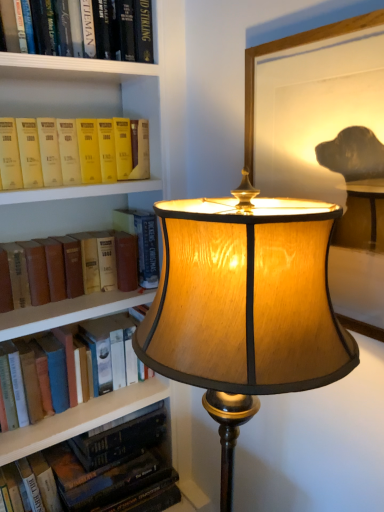
You are a GUI agent. You are given a task and a screenshot of the screen. Output one action in this format:
    pyautogui.click(x=<x>, y=<y>)
    Task: Click on the hardcover book at center, the 4th book in the bottom-to-top sequence
    Image resolution: width=384 pixels, height=512 pixels.
    Given the screenshot: What is the action you would take?
    pyautogui.click(x=141, y=242)

This screenshot has width=384, height=512. Find the location of `hardcover book at lower left, which is the fifth book from top to bottom`. hardcover book at lower left, which is the fifth book from top to bottom is located at coordinates pos(113,461).

Is point (93, 471) positioned behind point (105, 227)?

That is False.

Consider the image. Between hardcover book at lower left, which is the fifth book from top to bottom, and brown leather book at left, which is counted as the 3th book, starting from the bottom, which one is positioned in front?

brown leather book at left, which is counted as the 3th book, starting from the bottom, is closer to the camera.

Is hardcover book at lower left, which is the fifth book from top to bottom, with brown leather book at left, which is counted as the 3th book, starting from the top?

They are not placed beside each other.

Is there a large distance between wooden picture frame at upper right and wooden lampshade at center?

That's not correct — wooden picture frame at upper right is a little close to wooden lampshade at center.

From the image's perspective, which object appears higher, wooden picture frame at upper right or wooden lampshade at center?

wooden picture frame at upper right appears higher in the image.

Looking at this image, considering the relative sizes of wooden picture frame at upper right and wooden lampshade at center in the image provided, is wooden picture frame at upper right smaller than wooden lampshade at center?

Yes, wooden picture frame at upper right is smaller than wooden lampshade at center.

Considering the sizes of matte yellow book at left, placed as the first book when sorted from top to bottom, and hardcover book at left, placed as the 4th book when sorted from top to bottom, in the image, is matte yellow book at left, placed as the first book when sorted from top to bottom, wider or thinner than hardcover book at left, placed as the 4th book when sorted from top to bottom,?

Considering their sizes, matte yellow book at left, placed as the first book when sorted from top to bottom, looks broader than hardcover book at left, placed as the 4th book when sorted from top to bottom.

Based on their sizes in the image, would you say matte yellow book at left, the 5th book from the bottom, is bigger or smaller than hardcover book at left, placed as the 4th book when sorted from top to bottom?

In the image, matte yellow book at left, the 5th book from the bottom, appears to be smaller than hardcover book at left, placed as the 4th book when sorted from top to bottom.

Between matte yellow book at left, placed as the first book when sorted from top to bottom, and hardcover book at left, placed as the 4th book when sorted from top to bottom, which one has more height?

Standing taller between the two is hardcover book at left, placed as the 4th book when sorted from top to bottom.

Is hardcover book at lower left, positioned as the 1th book in bottom-to-top order, positioned with its back to wooden lampshade at center?

No, wooden lampshade at center is not at the back of hardcover book at lower left, positioned as the 1th book in bottom-to-top order.

Considering their positions, is hardcover book at lower left, which is the fifth book from top to bottom, located in front of or behind wooden lampshade at center?

In the image, hardcover book at lower left, which is the fifth book from top to bottom, appears behind wooden lampshade at center.

Between hardcover book at lower left, which is the fifth book from top to bottom, and wooden lampshade at center, which one has more height?

wooden lampshade at center.

Which of these two, hardcover book at lower left, which is the fifth book from top to bottom, or wooden lampshade at center, is wider?

wooden lampshade at center is wider.

Considering the positions of objects wooden lampshade at center and hardcover book at lower left, positioned as the 1th book in bottom-to-top order, in the image provided, who is behind, wooden lampshade at center or hardcover book at lower left, positioned as the 1th book in bottom-to-top order,?

hardcover book at lower left, positioned as the 1th book in bottom-to-top order, is further away from the camera.

From the image's perspective, is wooden lampshade at center above or below hardcover book at lower left, which is the fifth book from top to bottom?

wooden lampshade at center is situated higher than hardcover book at lower left, which is the fifth book from top to bottom, in the image.

Looking at this image, is wooden lampshade at center aimed at hardcover book at lower left, which is the fifth book from top to bottom?

No.

Considering the sizes of wooden picture frame at upper right and brown leather book at left, which is counted as the 3th book, starting from the top, in the image, is wooden picture frame at upper right taller or shorter than brown leather book at left, which is counted as the 3th book, starting from the top,?

wooden picture frame at upper right is taller than brown leather book at left, which is counted as the 3th book, starting from the top.

Considering the relative positions of wooden picture frame at upper right and brown leather book at left, which is counted as the 3th book, starting from the bottom, in the image provided, is wooden picture frame at upper right to the left of brown leather book at left, which is counted as the 3th book, starting from the bottom, from the viewer's perspective?

No.

Based on the photo, how distant is wooden picture frame at upper right from brown leather book at left, which is counted as the 3th book, starting from the top?

wooden picture frame at upper right is 20.57 inches from brown leather book at left, which is counted as the 3th book, starting from the top.

From a real-world perspective, is wooden picture frame at upper right positioned over brown leather book at left, which is counted as the 3th book, starting from the bottom, based on gravity?

Correct, in the physical world, wooden picture frame at upper right is higher than brown leather book at left, which is counted as the 3th book, starting from the bottom.

From a real-world perspective, is hardcover book at left, the 2th book when ordered from bottom to top, positioned above or below wooden picture frame at upper right?

hardcover book at left, the 2th book when ordered from bottom to top, is below wooden picture frame at upper right.

Is hardcover book at left, placed as the 4th book when sorted from top to bottom, taller than wooden picture frame at upper right?

Incorrect, the height of hardcover book at left, placed as the 4th book when sorted from top to bottom, is not larger of that of wooden picture frame at upper right.

What's the angular difference between hardcover book at left, the 2th book when ordered from bottom to top, and wooden picture frame at upper right's facing directions?

The angle between the facing direction of hardcover book at left, the 2th book when ordered from bottom to top, and the facing direction of wooden picture frame at upper right is 90.2 degrees.

Would you say hardcover book at left, the 2th book when ordered from bottom to top, is outside wooden picture frame at upper right?

Yes, hardcover book at left, the 2th book when ordered from bottom to top, is not within wooden picture frame at upper right.

Where is `the 2nd book directly above the hardcover book at lower left, positioned as the 1th book in bottom-to-top order (from a real-world perspective)`? The width and height of the screenshot is (384, 512). the 2nd book directly above the hardcover book at lower left, positioned as the 1th book in bottom-to-top order (from a real-world perspective) is located at coordinates pos(78,259).

The image size is (384, 512). In order to click on lamp below the wooden picture frame at upper right (from the image's perspective) in this screenshot , I will do `click(244, 306)`.

Looking at the image, which one is located further to wooden lampshade at center, hardcover book at left, the 2th book when ordered from bottom to top, or brown leather book at left, which is counted as the 3th book, starting from the top?

The object further to wooden lampshade at center is hardcover book at left, the 2th book when ordered from bottom to top.

Estimate the real-world distances between objects in this image. Which object is closer to matte yellow book at left, placed as the first book when sorted from top to bottom, wooden lampshade at center or hardcover book at left, the 2th book when ordered from bottom to top?

Among the two, hardcover book at left, the 2th book when ordered from bottom to top, is located nearer to matte yellow book at left, placed as the first book when sorted from top to bottom.

Estimate the real-world distances between objects in this image. Which object is closer to matte yellow book at left, the 5th book from the bottom, hardcover book at left, placed as the 4th book when sorted from top to bottom, or wooden lampshade at center?

Among the two, hardcover book at left, placed as the 4th book when sorted from top to bottom, is located nearer to matte yellow book at left, the 5th book from the bottom.

Which object lies further to the anchor point matte yellow book at left, placed as the first book when sorted from top to bottom, hardcover book at left, placed as the 4th book when sorted from top to bottom, or brown leather book at left, which is counted as the 3th book, starting from the top?

The object further to matte yellow book at left, placed as the first book when sorted from top to bottom, is hardcover book at left, placed as the 4th book when sorted from top to bottom.

Based on their spatial positions, is matte yellow book at left, the 5th book from the bottom, or brown leather book at left, which is counted as the 3th book, starting from the top, closer to hardcover book at lower left, which is the fifth book from top to bottom?

Based on the image, brown leather book at left, which is counted as the 3th book, starting from the top, appears to be nearer to hardcover book at lower left, which is the fifth book from top to bottom.

Which object lies further to the anchor point wooden lampshade at center, hardcover book at center, the 4th book in the bottom-to-top sequence, or hardcover book at left, the 2th book when ordered from bottom to top?

The object further to wooden lampshade at center is hardcover book at left, the 2th book when ordered from bottom to top.

From the image, which object appears to be nearer to hardcover book at center, the 2th book in the top-to-bottom sequence, brown leather book at left, which is counted as the 3th book, starting from the bottom, or wooden picture frame at upper right?

The object closer to hardcover book at center, the 2th book in the top-to-bottom sequence, is brown leather book at left, which is counted as the 3th book, starting from the bottom.

When comparing their distances from hardcover book at center, the 2th book in the top-to-bottom sequence, does matte yellow book at left, the 5th book from the bottom, or hardcover book at lower left, which is the fifth book from top to bottom, seem further?

hardcover book at lower left, which is the fifth book from top to bottom, is further to hardcover book at center, the 2th book in the top-to-bottom sequence.

The width and height of the screenshot is (384, 512). Identify the location of book between wooden lampshade at center and brown leather book at left, which is counted as the 3th book, starting from the bottom, in the front-back direction. (64, 152).

This screenshot has width=384, height=512. In order to click on picture frame between wooden lampshade at center and hardcover book at center, the 4th book in the bottom-to-top sequence, in the front-back direction in this screenshot , I will do `click(290, 48)`.

This screenshot has width=384, height=512. Find the location of `book between hardcover book at center, the 4th book in the bottom-to-top sequence, and hardcover book at left, the 2th book when ordered from bottom to top, in the up-down direction`. book between hardcover book at center, the 4th book in the bottom-to-top sequence, and hardcover book at left, the 2th book when ordered from bottom to top, in the up-down direction is located at coordinates (78, 259).

Find the location of a particular element. The width and height of the screenshot is (384, 512). book between matte yellow book at left, placed as the first book when sorted from top to bottom, and brown leather book at left, which is counted as the 3th book, starting from the top, vertically is located at coordinates (141, 242).